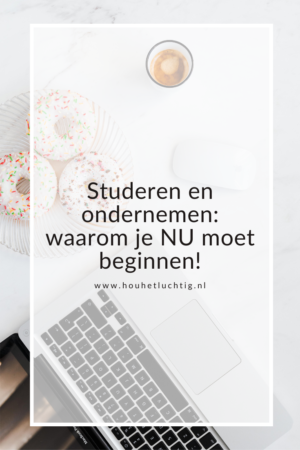
Where is `plate`? plate is located at coordinates (16, 240).